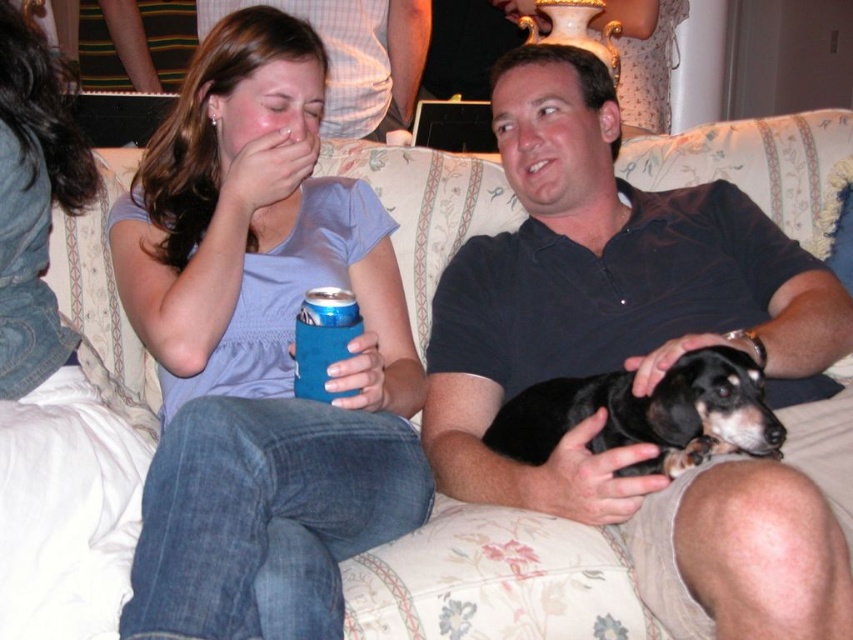
You are a photographer trying to capture a candid shot of the black smooth shirt at center and the black smooth dog at center. Since you want to focus on the dog, where should you position the camera to ensure the dog is in focus while the shirt is slightly blurred?

Position the camera closer to the black smooth dog at center and adjust the focus so that the black smooth dog at center is sharp while the black smooth shirt at center, which is above it, is slightly out of focus.

You are a photographer setting up a shoot in this living room. You need to position a light source so that it illuminates the black smooth shirt at center without casting a shadow over the matte blue fabric can cooler at left. Based on their positions, where should you place the light?

The black smooth shirt at center is above the matte blue fabric can cooler at left, so placing the light source below the shirt and aimed upwards would illuminate the shirt while avoiding casting a shadow over the cooler.

You are a photographer trying to capture a closeup shot of the black smooth shirt at center and the black smooth dog at center. Since you want to focus on both subjects equally, which one should you ensure is closer to the camera to maintain the same apparent size in the photo?

The black smooth shirt at center is wider than the black smooth dog at center. To keep their apparent sizes equal in the photo, the black smooth dog at center should be moved closer to the camera than the black smooth shirt at center.